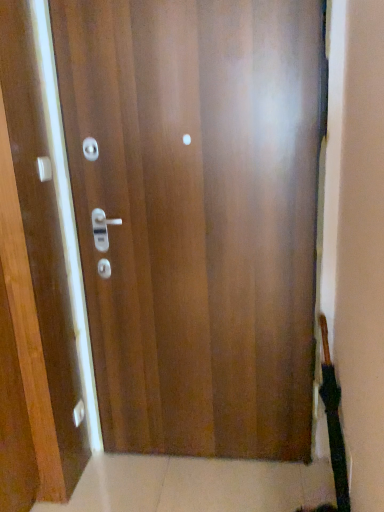
Question: Is matte silver knob at lower left facing away from glossy wood door at center?

Choices:
 (A) no
 (B) yes

Answer: (A)

Question: Is matte silver knob at lower left to the right of glossy wood door at center from the viewer's perspective?

Choices:
 (A) no
 (B) yes

Answer: (A)

Question: Is matte silver knob at lower left positioned in front of glossy wood door at center?

Choices:
 (A) yes
 (B) no

Answer: (B)

Question: Is matte silver knob at lower left not within glossy wood door at center?

Choices:
 (A) yes
 (B) no

Answer: (A)

Question: Is matte silver knob at lower left smaller than glossy wood door at center?

Choices:
 (A) yes
 (B) no

Answer: (A)

Question: Can you confirm if matte silver knob at lower left is shorter than glossy wood door at center?

Choices:
 (A) yes
 (B) no

Answer: (A)

Question: Is glossy wood door at center further to camera compared to matte silver knob at lower left?

Choices:
 (A) no
 (B) yes

Answer: (A)

Question: Can you confirm if glossy wood door at center is bigger than matte silver knob at lower left?

Choices:
 (A) no
 (B) yes

Answer: (B)

Question: From a real-world perspective, is glossy wood door at center under matte silver knob at lower left?

Choices:
 (A) no
 (B) yes

Answer: (A)

Question: Is glossy wood door at center closer to camera compared to matte silver knob at lower left?

Choices:
 (A) yes
 (B) no

Answer: (A)

Question: From the image's perspective, does glossy wood door at center appear higher than matte silver knob at lower left?

Choices:
 (A) no
 (B) yes

Answer: (B)

Question: From a real-world perspective, is glossy wood door at center on matte silver knob at lower left?

Choices:
 (A) yes
 (B) no

Answer: (A)

Question: Does matte silver knob at lower left lie in front of matte white handle at upper left?

Choices:
 (A) no
 (B) yes

Answer: (A)